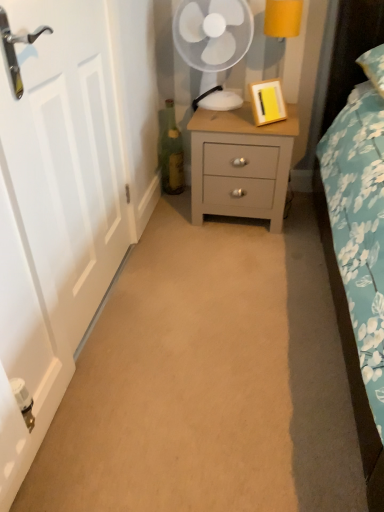
Question: Are matte gray nightstand at center and white matte door at left far apart?

Choices:
 (A) no
 (B) yes

Answer: (A)

Question: Considering the relative sizes of matte gray nightstand at center and white matte door at left in the image provided, is matte gray nightstand at center wider than white matte door at left?

Choices:
 (A) yes
 (B) no

Answer: (A)

Question: Is matte gray nightstand at center behind white matte door at left?

Choices:
 (A) yes
 (B) no

Answer: (A)

Question: From a real-world perspective, is matte gray nightstand at center below white matte door at left?

Choices:
 (A) yes
 (B) no

Answer: (A)

Question: From a real-world perspective, is matte gray nightstand at center positioned over white matte door at left based on gravity?

Choices:
 (A) no
 (B) yes

Answer: (A)

Question: Can you confirm if matte gray nightstand at center is positioned to the right of white matte door at left?

Choices:
 (A) yes
 (B) no

Answer: (A)

Question: Is white matte door at left positioned in front of matte gray nightstand at center?

Choices:
 (A) no
 (B) yes

Answer: (B)

Question: From a real-world perspective, does white matte door at left sit lower than matte gray nightstand at center?

Choices:
 (A) yes
 (B) no

Answer: (B)

Question: From the image's perspective, is white matte door at left located beneath matte gray nightstand at center?

Choices:
 (A) no
 (B) yes

Answer: (B)

Question: Are white matte door at left and matte gray nightstand at center beside each other?

Choices:
 (A) no
 (B) yes

Answer: (A)

Question: Is white matte door at left outside of matte gray nightstand at center?

Choices:
 (A) yes
 (B) no

Answer: (A)

Question: Is white matte door at left oriented away from matte gray nightstand at center?

Choices:
 (A) no
 (B) yes

Answer: (A)

Question: Does green glass bottle at center have a lesser width compared to yellow fabric lampshade at upper right?

Choices:
 (A) yes
 (B) no

Answer: (A)